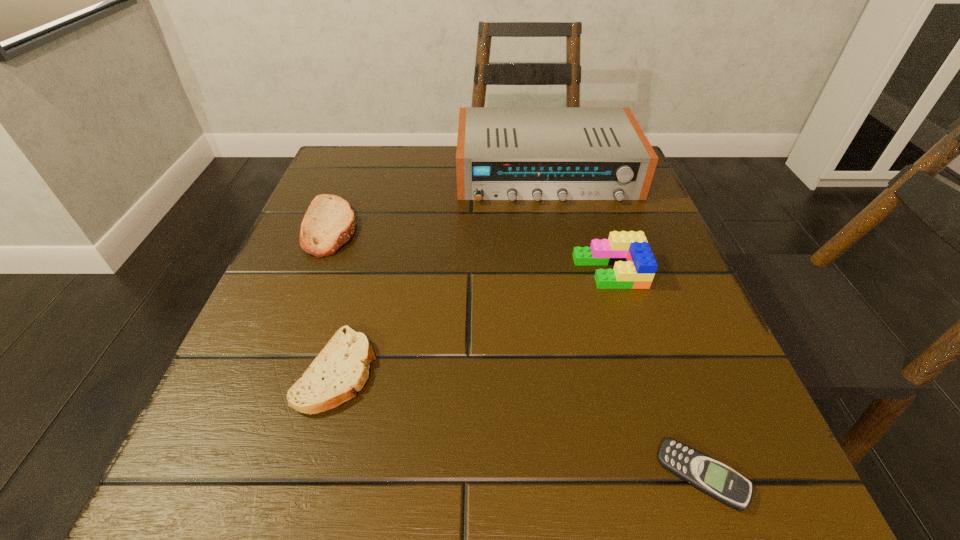
At what (x,y) coordinates should I click in order to perform the action: click on free spot that satisfies the following two spatial constraints: 1. on the front panel of the nearest object; 2. on the right side of the tallest object. Please return your answer as a coordinate pair (x, y). This screenshot has width=960, height=540. Looking at the image, I should click on (609, 476).